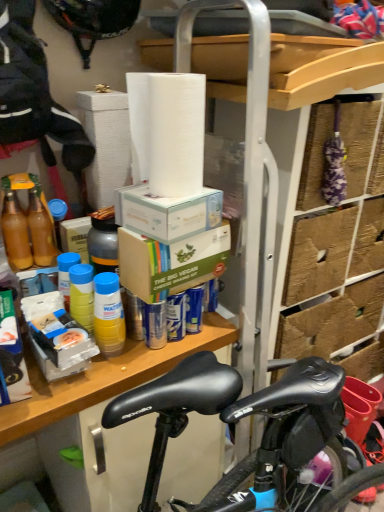
Question: Is brown cardboard box at center, the first box in the bottom-to-top sequence, at the back of white cardboard box at upper center, which is the 2th box from bottom to top?

Choices:
 (A) yes
 (B) no

Answer: (B)

Question: Is white cardboard box at upper center, which is the 2th box from bottom to top, shorter than brown cardboard box at center, which appears as the second box when viewed from the top?

Choices:
 (A) yes
 (B) no

Answer: (A)

Question: Would you say brown cardboard box at center, which appears as the second box when viewed from the top, is part of white cardboard box at upper center, which is the first box from top to bottom,'s contents?

Choices:
 (A) no
 (B) yes

Answer: (A)

Question: Is there a large distance between white cardboard box at upper center, which is the first box from top to bottom, and brown cardboard box at center, which appears as the second box when viewed from the top?

Choices:
 (A) yes
 (B) no

Answer: (B)

Question: Is white cardboard box at upper center, which is the 2th box from bottom to top, completely or partially outside of brown cardboard box at center, which appears as the second box when viewed from the top?

Choices:
 (A) yes
 (B) no

Answer: (A)

Question: Is white cardboard box at upper center, which is the 2th box from bottom to top, smaller than brown cardboard box at center, which appears as the second box when viewed from the top?

Choices:
 (A) no
 (B) yes

Answer: (B)

Question: Is wooden shelf at center bigger than white matte paper towel at upper center?

Choices:
 (A) yes
 (B) no

Answer: (A)

Question: Is the position of wooden shelf at center more distant than that of white matte paper towel at upper center?

Choices:
 (A) no
 (B) yes

Answer: (B)

Question: From a real-world perspective, is wooden shelf at center physically below white matte paper towel at upper center?

Choices:
 (A) yes
 (B) no

Answer: (A)

Question: Is wooden shelf at center located outside white matte paper towel at upper center?

Choices:
 (A) yes
 (B) no

Answer: (A)

Question: Considering the relative sizes of wooden shelf at center and white matte paper towel at upper center in the image provided, is wooden shelf at center smaller than white matte paper towel at upper center?

Choices:
 (A) yes
 (B) no

Answer: (B)

Question: Is wooden shelf at center at the left side of white matte paper towel at upper center?

Choices:
 (A) yes
 (B) no

Answer: (A)

Question: From the image's perspective, is wooden shelf at center on translucent plastic bottle at shelf center, which is the third bottle from right to left?

Choices:
 (A) yes
 (B) no

Answer: (B)